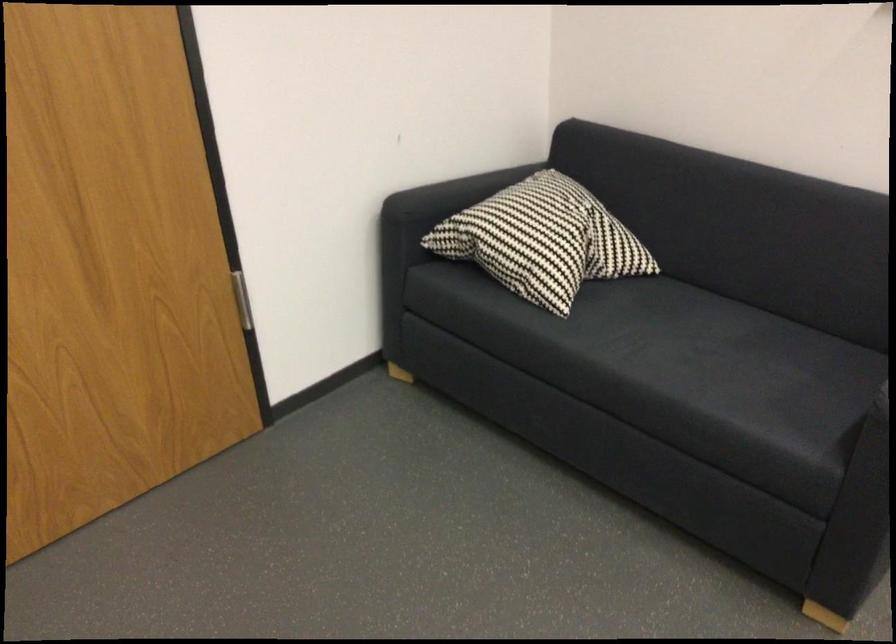
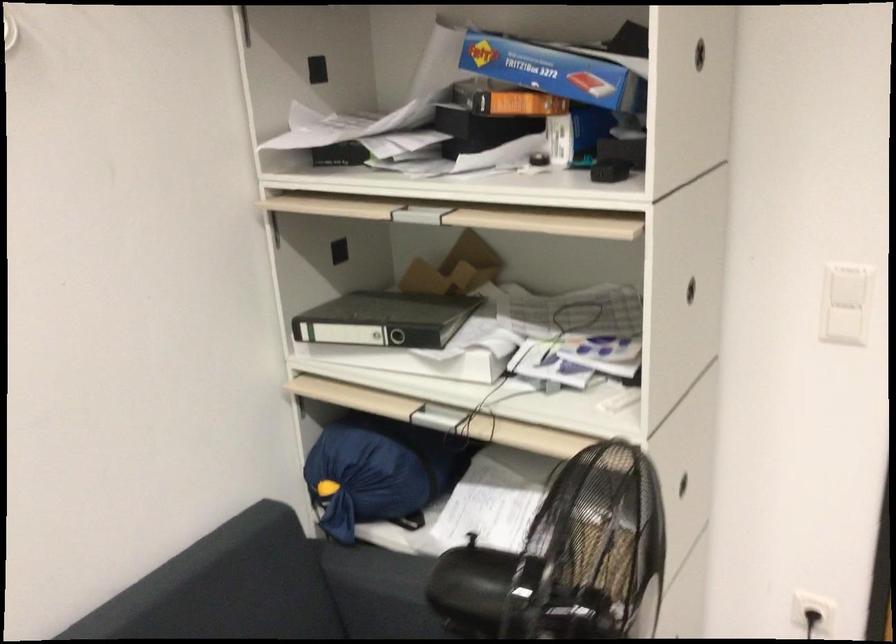
Question: The camera is either moving clockwise (left) or counter-clockwise (right) around the object. The first image is from the beginning of the video and the second image is from the end. Is the camera moving left or right when shooting the video?

Choices:
 (A) Left
 (B) Right

Answer: (B)